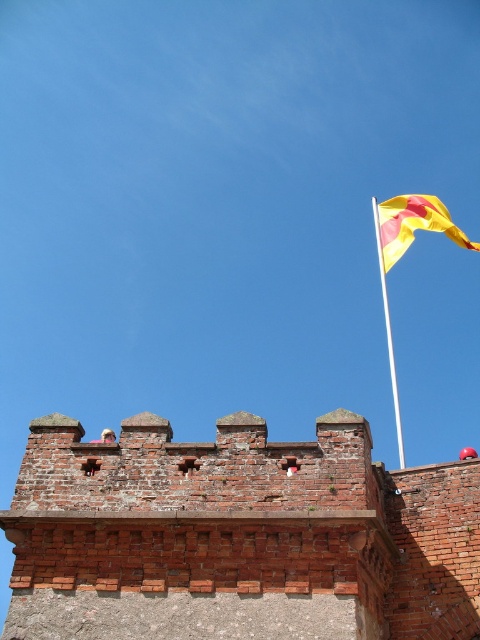
Image resolution: width=480 pixels, height=640 pixels. What do you see at coordinates (238, 536) in the screenshot?
I see `red brick wall at upper center` at bounding box center [238, 536].

This screenshot has width=480, height=640. In order to click on red brick wall at upper center in this screenshot , I will do `click(238, 536)`.

Where is `red brick wall at upper center`? The height and width of the screenshot is (640, 480). red brick wall at upper center is located at coordinates (238, 536).

How much distance is there between red brick wall at upper center and yellow fabric flag at upper right?

red brick wall at upper center is 35.65 meters from yellow fabric flag at upper right.

Is red brick wall at upper center wider than yellow fabric flag at upper right?

A: No.

Identify the location of red brick wall at upper center. Image resolution: width=480 pixels, height=640 pixels. (238, 536).

You are a GUI agent. You are given a task and a screenshot of the screen. Output one action in this format:
    pyautogui.click(x=<x>, y=<y>)
    Task: Click on the yellow fabric flag at upper right
    Image resolution: width=480 pixels, height=640 pixels.
    Given the screenshot: What is the action you would take?
    pyautogui.click(x=411, y=225)

Does yellow fabric flag at upper right have a smaller size compared to white metallic flag pole at upper right?

Indeed, yellow fabric flag at upper right has a smaller size compared to white metallic flag pole at upper right.

Which is in front, point (417, 220) or point (382, 296)?

Point (417, 220)

Locate an element on the screen. This screenshot has width=480, height=640. yellow fabric flag at upper right is located at coordinates (411, 225).